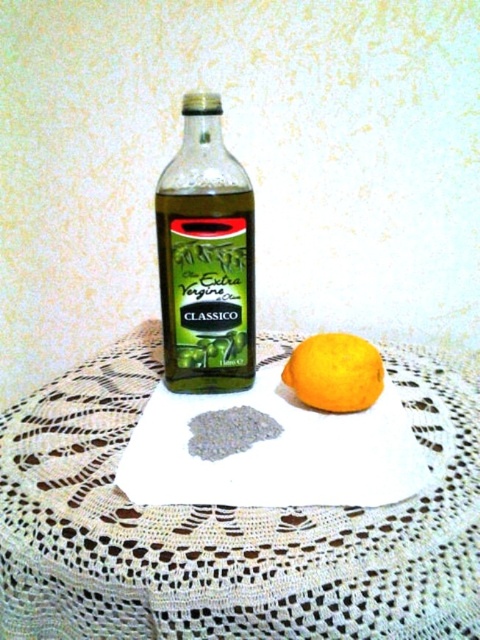
You are holding a ruler and want to measure the distance from your eye level to the point marked at coordinates (422,576) on the image. What is the actual distance in inches?

The point at coordinates (422,576) is 14.28 inches away from the viewer, so the actual distance is 14.28 inches.

You are arranging items on a table and need to place both the green glass bottle at center and the orange matte at center. If you want to place them side by side without overlapping, which one should you position first to accommodate their widths?

The green glass bottle at center is wider than the orange matte at center, so you should position the green glass bottle at center first to ensure there is enough space for both items.

What is located at the coordinates point [205,257]?

The point [205,257] corresponds to the green glass bottle at center.